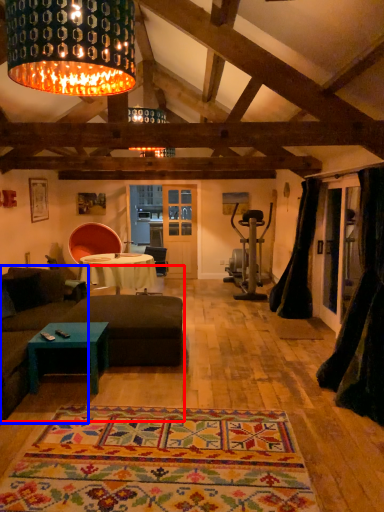
Question: Among these objects, which one is nearest to the camera, studio couch (highlighted by a red box) or couch (highlighted by a blue box)?

Choices:
 (A) studio couch
 (B) couch

Answer: (A)